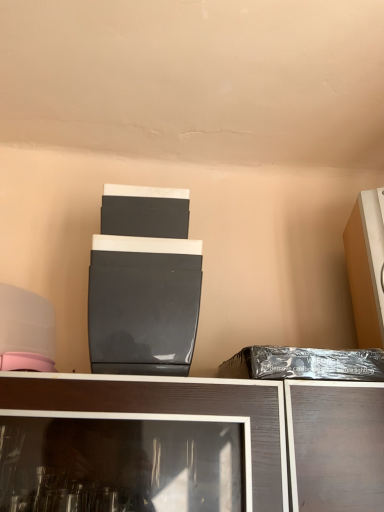
Question: Do you think matte black appliance at center, arranged as the 1th appliance when viewed from the left, is within matte orange cabinet at right, which ranks as the first appliance in right-to-left order, or outside of it?

Choices:
 (A) outside
 (B) inside

Answer: (A)

Question: Based on their positions, is matte black appliance at center, which is counted as the second appliance, starting from the right, located to the left or right of matte orange cabinet at right, which ranks as the first appliance in right-to-left order?

Choices:
 (A) right
 (B) left

Answer: (B)

Question: Estimate the real-world distances between objects in this image. Which object is farther from the black plastic bag at right?

Choices:
 (A) matte orange cabinet at right, the 2th appliance positioned from the left
 (B) matte black appliance at center, arranged as the 1th appliance when viewed from the left

Answer: (B)

Question: Which of these objects is positioned farthest from the matte orange cabinet at right, the 2th appliance positioned from the left?

Choices:
 (A) matte black appliance at center, arranged as the 1th appliance when viewed from the left
 (B) black plastic bag at right

Answer: (A)